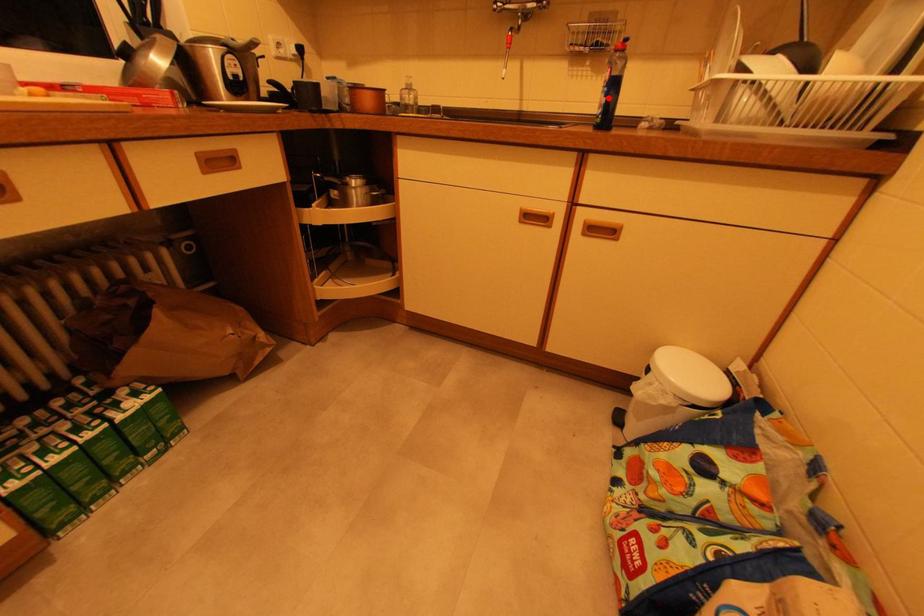
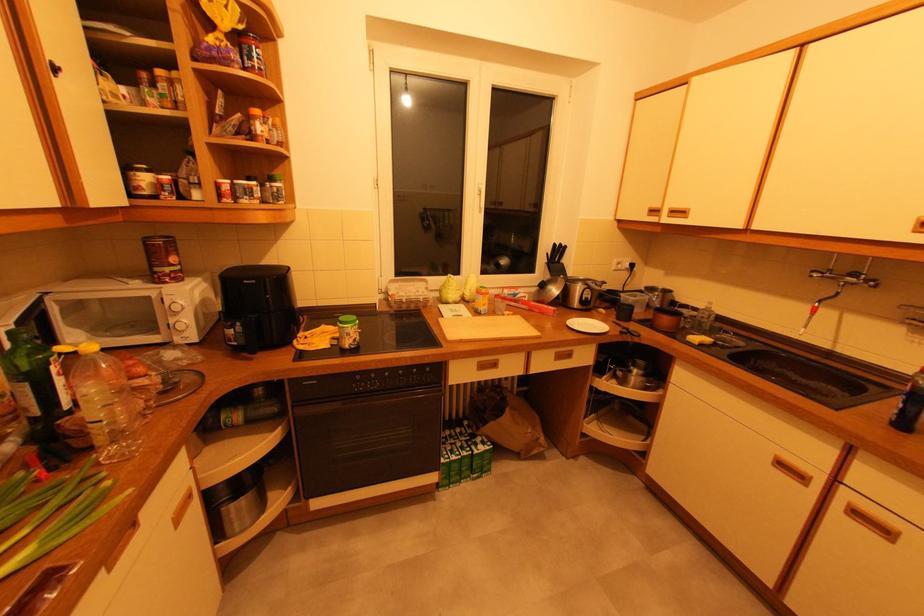
Question: A red point is marked in image1. In image2, is the corresponding 3D point closer to the camera or farther? Reply with the corresponding letter.

Choices:
 (A) The corresponding 3D point is closer.
 (B) The corresponding 3D point is farther.

Answer: (B)